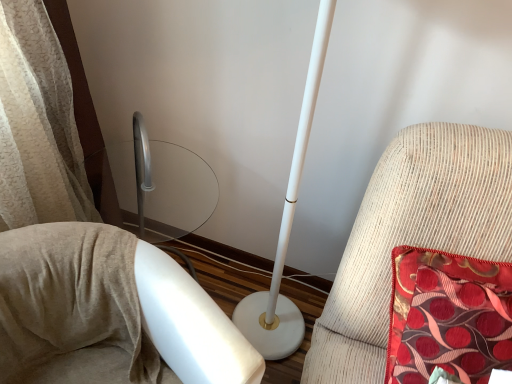
Question: From the image's perspective, does white glossy floor lamp at center, the 2th furniture positioned from the right, appear higher than red satin cushion at right, positioned as the 2th furniture in left-to-right order?

Choices:
 (A) yes
 (B) no

Answer: (B)

Question: From a real-world perspective, is white glossy floor lamp at center, which is the 1th furniture from left to right, located higher than red satin cushion at right, positioned as the 2th furniture in left-to-right order?

Choices:
 (A) yes
 (B) no

Answer: (B)

Question: Can you confirm if white glossy floor lamp at center, the 2th furniture positioned from the right, is taller than red satin cushion at right, which is the first furniture from right to left?

Choices:
 (A) no
 (B) yes

Answer: (B)

Question: Considering the relative sizes of white glossy floor lamp at center, which is the 1th furniture from left to right, and red satin cushion at right, which is the first furniture from right to left, in the image provided, is white glossy floor lamp at center, which is the 1th furniture from left to right, smaller than red satin cushion at right, which is the first furniture from right to left,?

Choices:
 (A) yes
 (B) no

Answer: (B)

Question: Is white glossy floor lamp at center, the 2th furniture positioned from the right, completely or partially outside of red satin cushion at right, positioned as the 2th furniture in left-to-right order?

Choices:
 (A) no
 (B) yes

Answer: (B)

Question: Can you see white glossy floor lamp at center, which is the 1th furniture from left to right, touching red satin cushion at right, which is the first furniture from right to left?

Choices:
 (A) yes
 (B) no

Answer: (B)

Question: Does red satin cushion at right, positioned as the 2th furniture in left-to-right order, have a greater width compared to white glossy floor lamp at center, which is the 1th furniture from left to right?

Choices:
 (A) no
 (B) yes

Answer: (A)

Question: From the image's perspective, would you say red satin cushion at right, positioned as the 2th furniture in left-to-right order, is shown under white glossy floor lamp at center, the 2th furniture positioned from the right?

Choices:
 (A) yes
 (B) no

Answer: (B)

Question: Does red satin cushion at right, which is the first furniture from right to left, have a lesser height compared to white glossy floor lamp at center, the 2th furniture positioned from the right?

Choices:
 (A) no
 (B) yes

Answer: (B)

Question: Is red satin cushion at right, positioned as the 2th furniture in left-to-right order, to the left of white glossy floor lamp at center, the 2th furniture positioned from the right, from the viewer's perspective?

Choices:
 (A) yes
 (B) no

Answer: (B)

Question: Is red satin cushion at right, which is the first furniture from right to left, located outside white glossy floor lamp at center, which is the 1th furniture from left to right?

Choices:
 (A) yes
 (B) no

Answer: (A)

Question: Is red satin cushion at right, positioned as the 2th furniture in left-to-right order, oriented away from white glossy floor lamp at center, which is the 1th furniture from left to right?

Choices:
 (A) yes
 (B) no

Answer: (B)

Question: Is point (340, 307) closer or farther from the camera than point (79, 344)?

Choices:
 (A) closer
 (B) farther

Answer: (B)